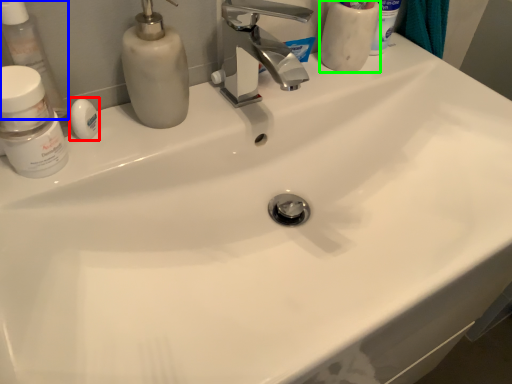
Question: Which object is the farthest from soap (highlighted by a red box)? Choose among these: toiletry (highlighted by a blue box) or toiletry (highlighted by a green box).

Choices:
 (A) toiletry
 (B) toiletry

Answer: (B)